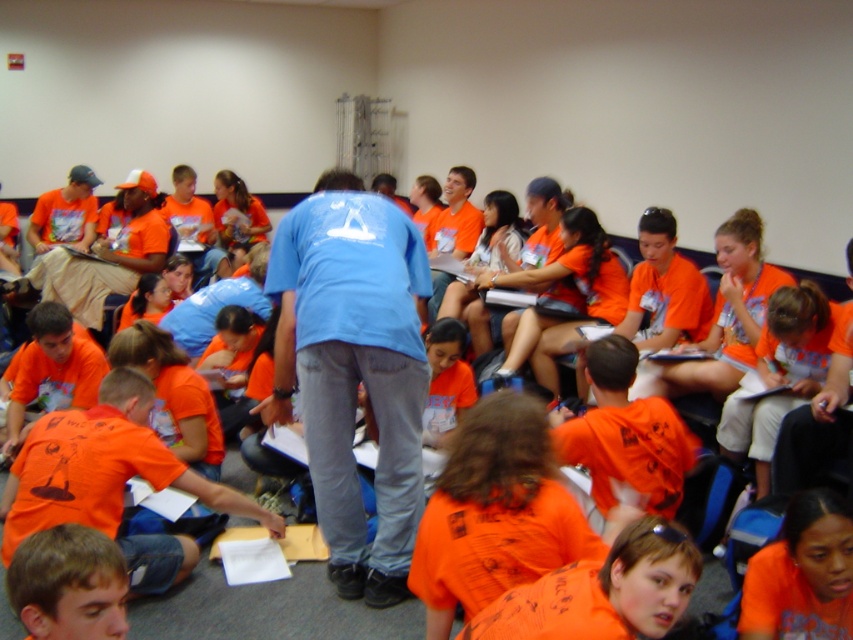
You are a photographer standing at the back of the classroom. You want to take a photo that includes both the blue cotton shirt at center and the orange matte shirt at lower right. What is the minimum distance you need to move forward to ensure both shirts are in frame?

The blue cotton shirt at center is 38.77 inches from the orange matte shirt at lower right. To include both in the photo, you need to move forward until your camera can capture a field of view that spans at least 38.77 inches between the two shirts.

You are standing in the classroom and want to find the blue cotton shirt at center. Where should you look according to the coordinates provided?

The blue cotton shirt at center is located at the 2D coordinates point (352, 371).

Based on the photo, you are organizing a photo shoot and need to arrange the blue cotton shirt at center and orange matte shirt at lower right in a way that highlights their sizes. Which shirt should be placed in the foreground to emphasize its size difference?

The blue cotton shirt at center should be placed in the foreground because it is bigger than the orange matte shirt at lower right, creating a visual contrast between their sizes.